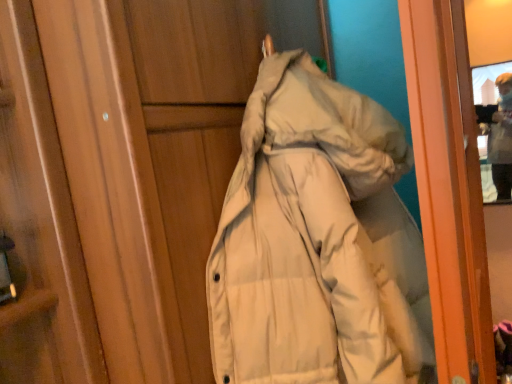
Question: Is beige down jacket at upper center shorter than beige matte coat at center?

Choices:
 (A) no
 (B) yes

Answer: (B)

Question: Is beige down jacket at upper center in contact with beige matte coat at center?

Choices:
 (A) yes
 (B) no

Answer: (B)

Question: Is the position of beige down jacket at upper center less distant than that of beige matte coat at center?

Choices:
 (A) no
 (B) yes

Answer: (A)

Question: Is beige down jacket at upper center oriented towards beige matte coat at center?

Choices:
 (A) yes
 (B) no

Answer: (B)

Question: Considering the relative sizes of beige down jacket at upper center and beige matte coat at center in the image provided, is beige down jacket at upper center smaller than beige matte coat at center?

Choices:
 (A) yes
 (B) no

Answer: (A)

Question: Is beige down jacket at upper center at the right side of beige matte coat at center?

Choices:
 (A) no
 (B) yes

Answer: (B)

Question: Is beige matte coat at center facing away from beige down jacket at upper center?

Choices:
 (A) no
 (B) yes

Answer: (A)

Question: Is beige matte coat at center smaller than beige down jacket at upper center?

Choices:
 (A) yes
 (B) no

Answer: (B)

Question: From the image's perspective, is beige matte coat at center under beige down jacket at upper center?

Choices:
 (A) no
 (B) yes

Answer: (B)

Question: Does beige matte coat at center have a greater width compared to beige down jacket at upper center?

Choices:
 (A) yes
 (B) no

Answer: (A)

Question: Is beige matte coat at center behind beige down jacket at upper center?

Choices:
 (A) yes
 (B) no

Answer: (B)

Question: From the image's perspective, is beige matte coat at center over beige down jacket at upper center?

Choices:
 (A) yes
 (B) no

Answer: (B)

Question: From the image's perspective, is beige down jacket at upper center located above or below beige matte coat at center?

Choices:
 (A) below
 (B) above

Answer: (B)